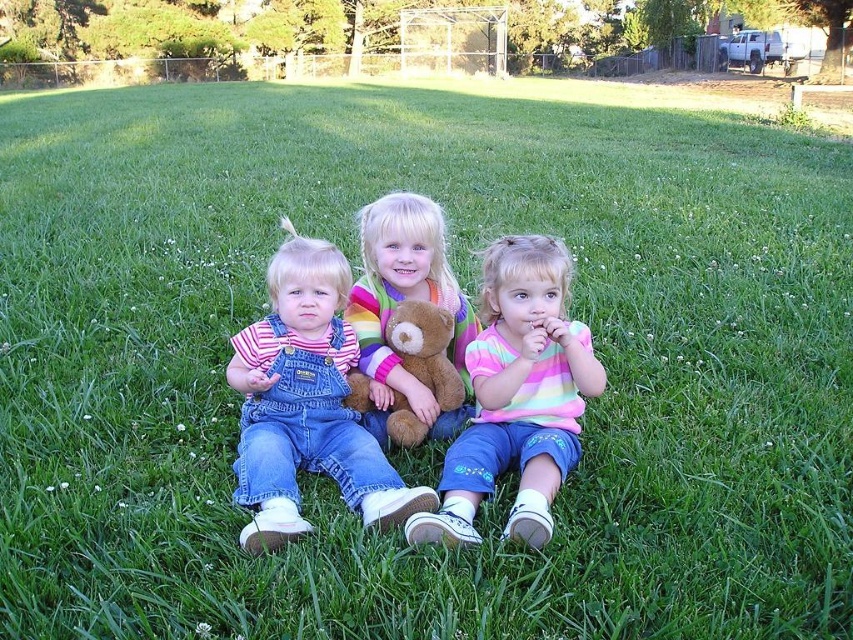
Question: Is striped cotton shirt at center bigger than multicolored striped shirt at center?

Choices:
 (A) no
 (B) yes

Answer: (B)

Question: Is denim overalls at center above striped cotton shirt at center?

Choices:
 (A) no
 (B) yes

Answer: (B)

Question: Does striped cotton shirt at center appear on the right side of multicolored striped shirt at center?

Choices:
 (A) yes
 (B) no

Answer: (A)

Question: Which of the following is the closest to the observer?

Choices:
 (A) denim overalls at center
 (B) multicolored striped shirt at center

Answer: (A)

Question: Which of the following is the farthest from the observer?

Choices:
 (A) multicolored striped shirt at center
 (B) striped cotton shirt at center

Answer: (A)

Question: Among these points, which one is farthest from the camera?

Choices:
 (A) (260, 340)
 (B) (379, 298)

Answer: (B)